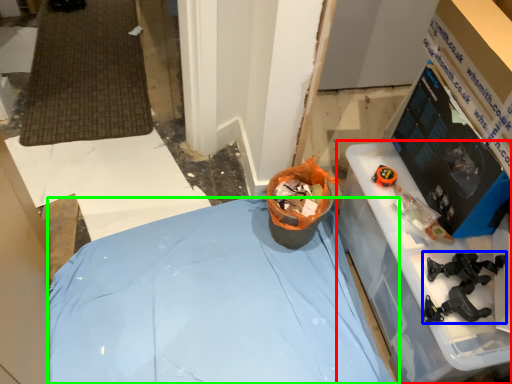
Question: Estimate the real-world distances between objects in this image. Which object is farther from furniture (highlighted by a red box), tool (highlighted by a blue box) or furniture (highlighted by a green box)?

Choices:
 (A) tool
 (B) furniture

Answer: (B)